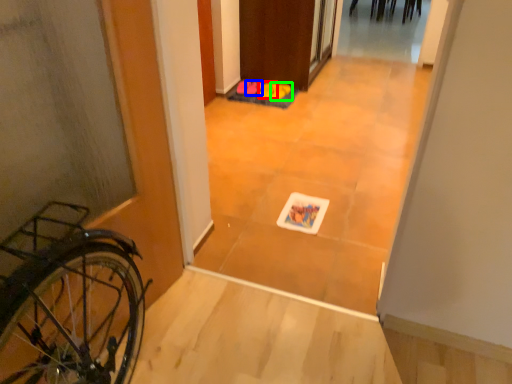
Question: Based on their relative distances, which object is nearer to footwear (highlighted by a red box)? Choose from footwear (highlighted by a blue box) and footwear (highlighted by a green box).

Choices:
 (A) footwear
 (B) footwear

Answer: (B)